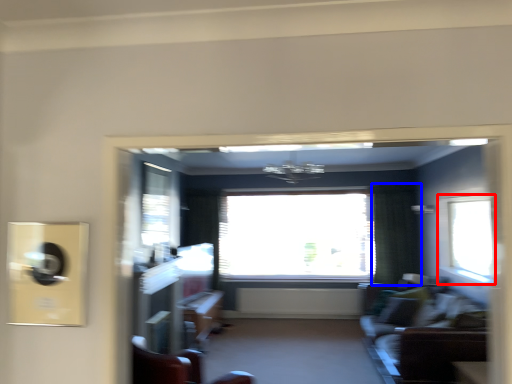
Question: Which object appears farthest to the camera in this image, window (highlighted by a red box) or curtain (highlighted by a blue box)?

Choices:
 (A) window
 (B) curtain

Answer: (B)